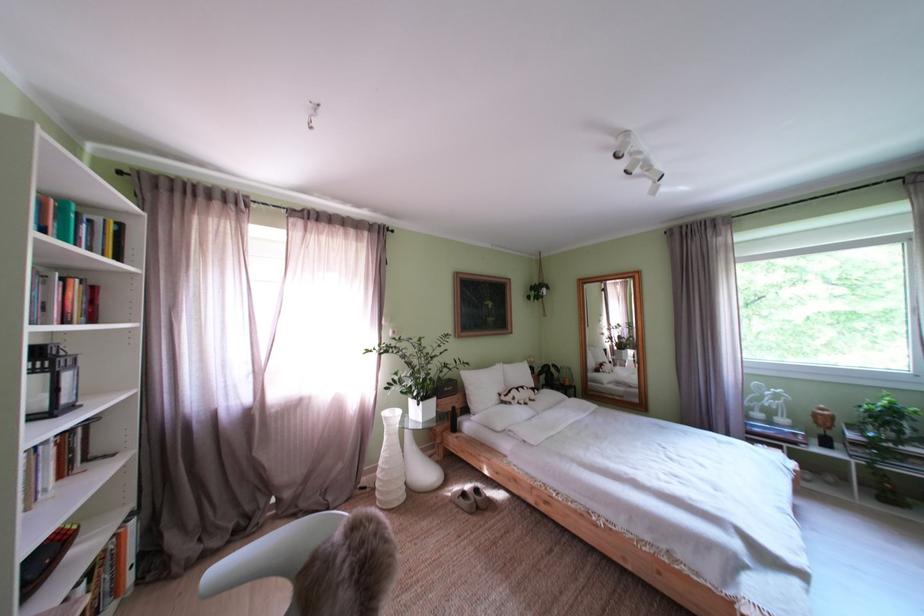
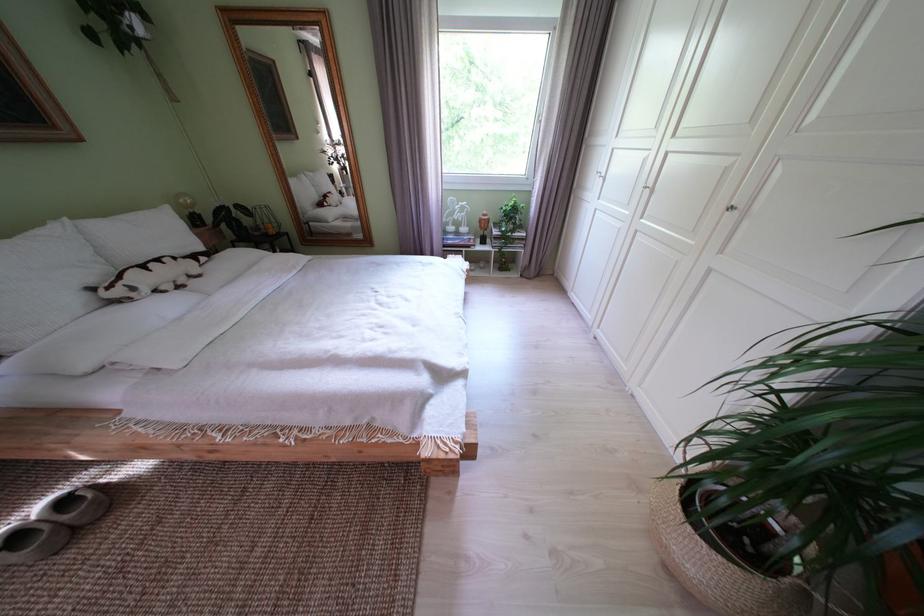
Locate, in the second image, the point that corresponds to pixel 743 422 in the first image.

(445, 241)